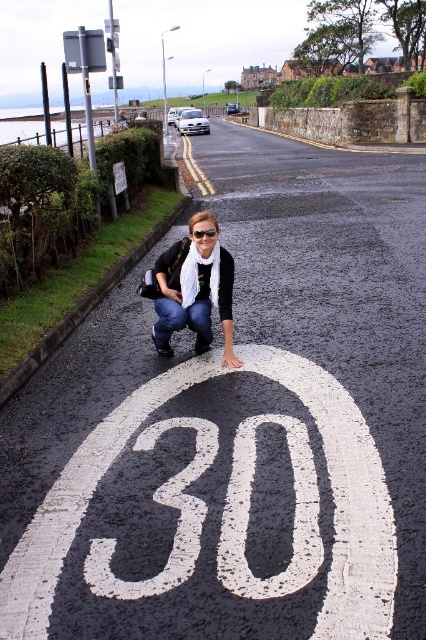
Question: Is white painted number at center behind black plastic goggles at center?

Choices:
 (A) no
 (B) yes

Answer: (A)

Question: Which of the following is the closest to the observer?

Choices:
 (A) (204, 234)
 (B) (212, 426)
 (C) (74, 308)
 (D) (209, 332)

Answer: (B)

Question: Among these objects, which one is nearest to the camera?

Choices:
 (A) white painted number at center
 (B) black plastic goggles at center
 (C) gray asphalt curb at lower left
 (D) matte black scarf at center

Answer: (A)

Question: Among these points, which one is farthest from the camera?

Choices:
 (A) (181, 536)
 (B) (192, 234)
 (C) (46, 339)
 (D) (167, 353)

Answer: (C)

Question: Is gray asphalt curb at lower left in front of black plastic goggles at center?

Choices:
 (A) no
 (B) yes

Answer: (B)

Question: Can you confirm if matte black scarf at center is positioned above black plastic goggles at center?

Choices:
 (A) no
 (B) yes

Answer: (A)